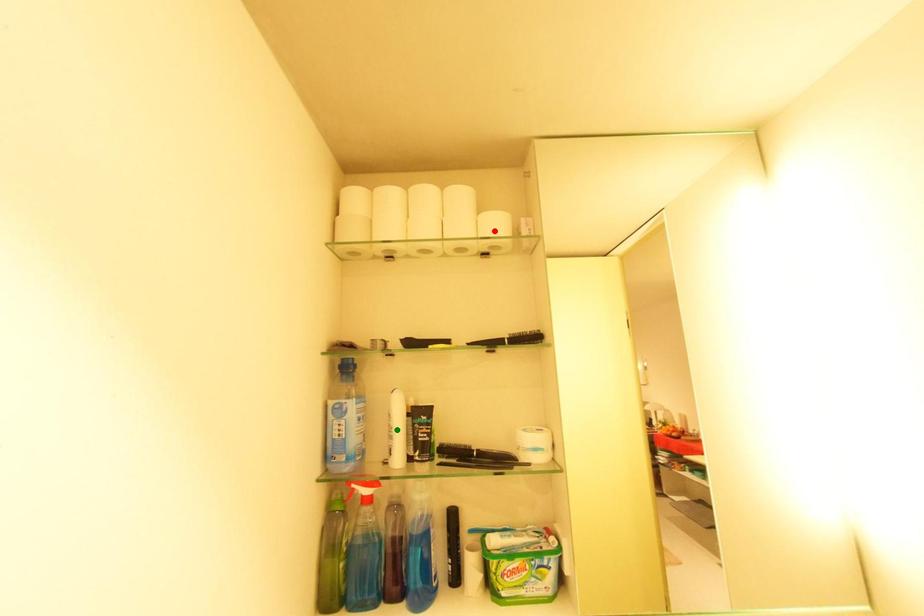
Order these from farthest to nearest:
red point, orange point, green point

red point < green point < orange point